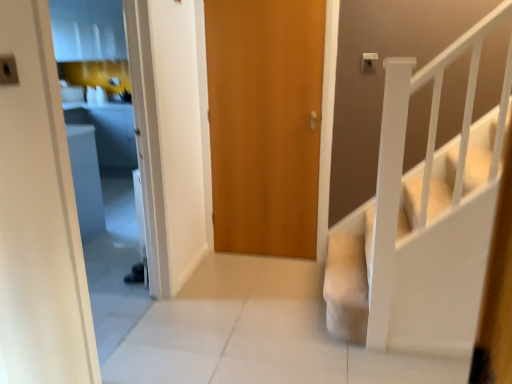
Where is `wooden door at center`? This screenshot has height=384, width=512. wooden door at center is located at coordinates (265, 123).

Image resolution: width=512 pixels, height=384 pixels. What do you see at coordinates (265, 123) in the screenshot?
I see `wooden door at center` at bounding box center [265, 123].

Measure the distance between point (457, 267) and camera.

Point (457, 267) and camera are 6.36 feet apart.

This screenshot has width=512, height=384. In order to click on white painted wood stairs at right in this screenshot , I will do `click(443, 240)`.

Image resolution: width=512 pixels, height=384 pixels. Describe the element at coordinates (443, 240) in the screenshot. I see `white painted wood stairs at right` at that location.

Find the location of a particular element. This screenshot has width=512, height=384. wooden door at center is located at coordinates (265, 123).

Which is more to the left, white painted wood stairs at right or wooden door at center?

From the viewer's perspective, wooden door at center appears more on the left side.

Which object is further away from the camera, white painted wood stairs at right or wooden door at center?

wooden door at center is further from the camera.

Which is farther from the camera, (453, 156) or (297, 63)?

The point (297, 63) is behind.

From the image's perspective, which one is positioned higher, white painted wood stairs at right or wooden door at center?

From the image's view, wooden door at center is above.

From a real-world perspective, is white painted wood stairs at right over wooden door at center?

Incorrect, from a real-world perspective, white painted wood stairs at right is lower than wooden door at center.

Between white painted wood stairs at right and wooden door at center, which one has smaller width?

wooden door at center.

Is white painted wood stairs at right taller or shorter than wooden door at center?

Clearly, white painted wood stairs at right is shorter compared to wooden door at center.

Can you confirm if white painted wood stairs at right is bigger than wooden door at center?

Indeed, white painted wood stairs at right has a larger size compared to wooden door at center.

Does white painted wood stairs at right contain wooden door at center?

No, wooden door at center is located outside of white painted wood stairs at right.

Are white painted wood stairs at right and wooden door at center far apart?

No, white painted wood stairs at right is not far from wooden door at center.

Is white painted wood stairs at right positioned with its back to wooden door at center?

No, white painted wood stairs at right is not facing the opposite direction of wooden door at center.

You are a GUI agent. You are given a task and a screenshot of the screen. Output one action in this format:
    pyautogui.click(x=<x>, y=<y>)
    Task: Click on the stairs on the right of wooden door at center
    This screenshot has width=512, height=384.
    Given the screenshot: What is the action you would take?
    pyautogui.click(x=443, y=240)

Considering the relative positions of wooden door at center and white painted wood stairs at right in the image provided, is wooden door at center to the left or to the right of white painted wood stairs at right?

wooden door at center is to the left of white painted wood stairs at right.

In the image, is wooden door at center positioned in front of or behind white painted wood stairs at right?

Visually, wooden door at center is located behind white painted wood stairs at right.

Between point (262, 112) and point (468, 325), which one is positioned in front?

The point (468, 325) is in front.

Consider the image. From the image's perspective, is wooden door at center above white painted wood stairs at right?

Yes, from the image's perspective, wooden door at center is over white painted wood stairs at right.

From a real-world perspective, which is physically above, wooden door at center or white painted wood stairs at right?

From a 3D spatial view, wooden door at center is above.

Is wooden door at center thinner than white painted wood stairs at right?

Yes.

Considering the relative sizes of wooden door at center and white painted wood stairs at right in the image provided, is wooden door at center taller than white painted wood stairs at right?

Yes.

Considering the sizes of objects wooden door at center and white painted wood stairs at right in the image provided, who is bigger, wooden door at center or white painted wood stairs at right?

With larger size is white painted wood stairs at right.

Is white painted wood stairs at right surrounded by wooden door at center?

No.

Is wooden door at center not near white painted wood stairs at right?

No, wooden door at center is not far away from white painted wood stairs at right.

From the picture: Does wooden door at center turn towards white painted wood stairs at right?

No, wooden door at center is not oriented towards white painted wood stairs at right.

Image resolution: width=512 pixels, height=384 pixels. What are the coordinates of `stairs below the wooden door at center (from the image's perspective)` in the screenshot? It's located at (x=443, y=240).

The height and width of the screenshot is (384, 512). In order to click on stairs below the wooden door at center (from the image's perspective) in this screenshot , I will do `click(443, 240)`.

This screenshot has width=512, height=384. Identify the location of stairs below the wooden door at center (from a real-world perspective). (443, 240).